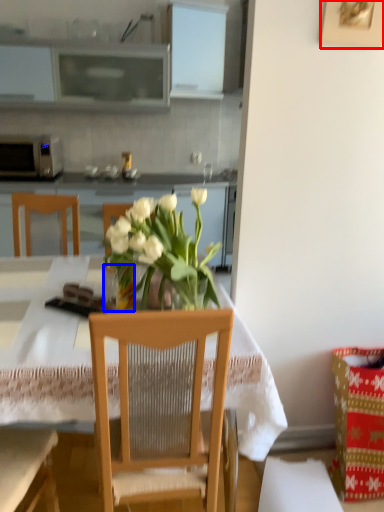
Question: Among these objects, which one is nearest to the camera, picture frame (highlighted by a red box) or vase (highlighted by a blue box)?

Choices:
 (A) picture frame
 (B) vase

Answer: (A)